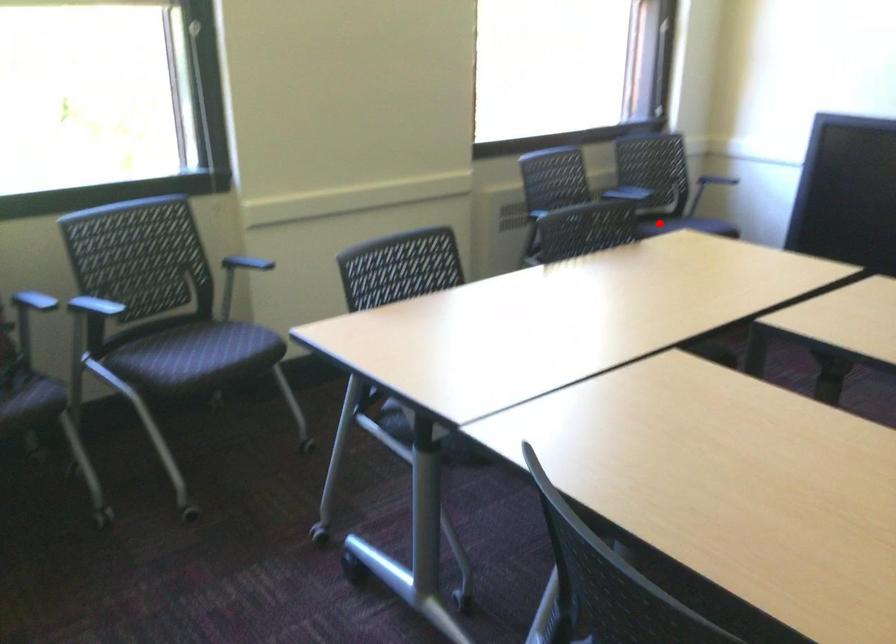
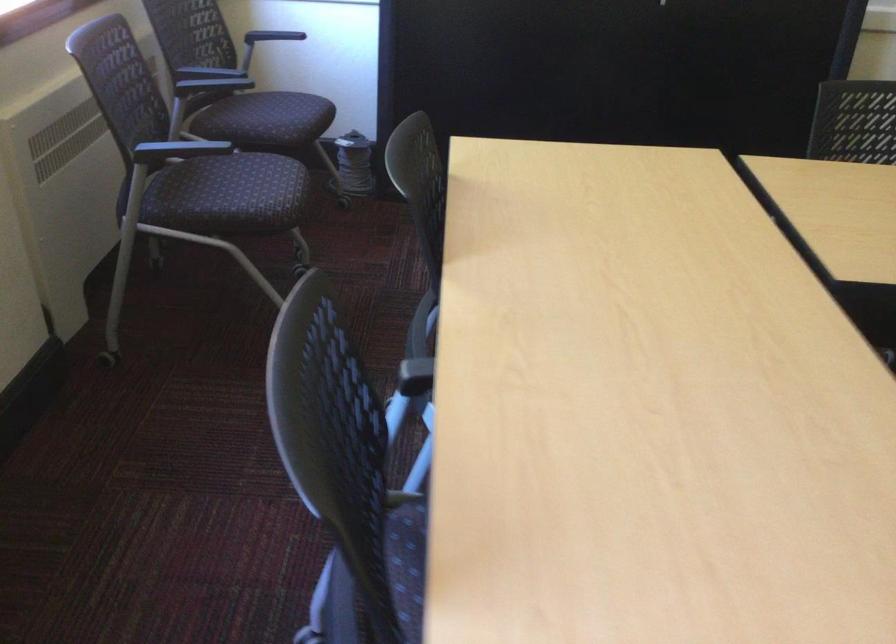
Find the pixel in the second image that matches the highlighted location in the first image.

(271, 120)